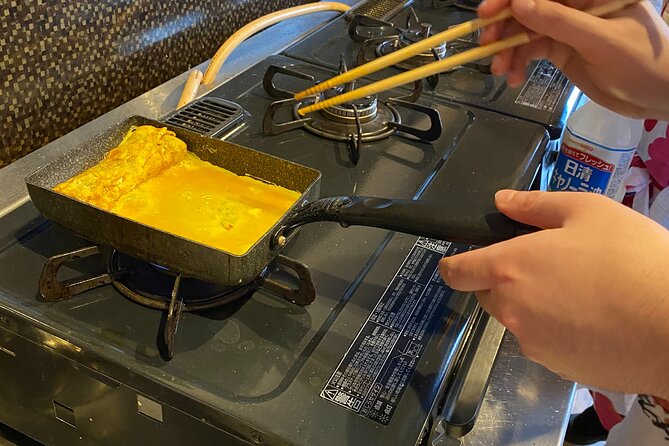
In order to click on tiled wall in this screenshot , I will do `click(100, 43)`.